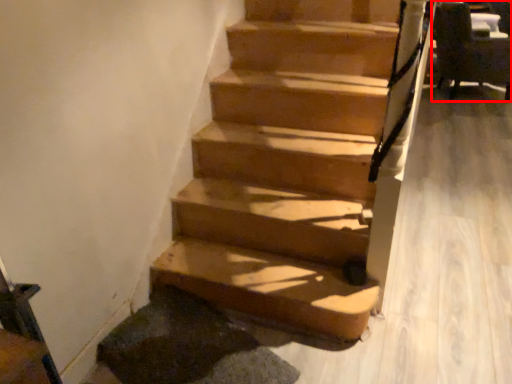
Question: Observing the image, what is the correct spatial positioning of armchair (annotated by the red box) in reference to stairs?

Choices:
 (A) left
 (B) right

Answer: (B)